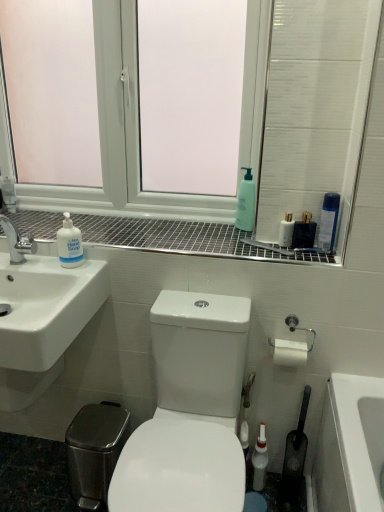
What is the approximate height of black plastic mouthwash at upper right, the third mouthwash viewed from the left?

The height of black plastic mouthwash at upper right, the third mouthwash viewed from the left, is 4.91 inches.

Where is `black plastic mouthwash at upper right, placed as the first mouthwash when sorted from right to left`? black plastic mouthwash at upper right, placed as the first mouthwash when sorted from right to left is located at coordinates [x=304, y=232].

What is the approximate width of clear plastic spray bottle at upper right, which appears as the first cleaning product when viewed from the right?

clear plastic spray bottle at upper right, which appears as the first cleaning product when viewed from the right, is 2.04 inches in width.

Identify the location of white plastic window at upper center. Image resolution: width=384 pixels, height=512 pixels. click(253, 136).

What is the approximate width of white glossy sink at lower left?

white glossy sink at lower left is 17.91 inches wide.

You are a GUI agent. You are given a task and a screenshot of the screen. Output one action in this format:
    pyautogui.click(x=<x>, y=<y>)
    Task: Click on the black plastic mouthwash at upper right, marked as the third mouthwash in a bottom-to-top arrangement
    
    Given the screenshot: What is the action you would take?
    pyautogui.click(x=304, y=232)

Does silver metallic toilet paper holder at right have a greater width compared to clear plastic spray bottle at upper right, which appears as the first cleaning product when viewed from the right?

Correct, the width of silver metallic toilet paper holder at right exceeds that of clear plastic spray bottle at upper right, which appears as the first cleaning product when viewed from the right.

Choose the correct answer: Is silver metallic toilet paper holder at right inside clear plastic spray bottle at upper right, which appears as the first cleaning product when viewed from the right, or outside it?

silver metallic toilet paper holder at right is not enclosed by clear plastic spray bottle at upper right, which appears as the first cleaning product when viewed from the right.

Is silver metallic toilet paper holder at right oriented away from clear plastic spray bottle at upper right, which appears as the first cleaning product when viewed from the right?

No, silver metallic toilet paper holder at right is not facing away from clear plastic spray bottle at upper right, which appears as the first cleaning product when viewed from the right.

What's the angular difference between silver metallic toilet paper holder at right and clear plastic spray bottle at upper right, the second cleaning product positioned from the left,'s facing directions?

They differ by 0.254 degrees in their facing directions.

Based on the photo, can you confirm if black plastic mouthwash at upper right, the third mouthwash viewed from the left, is smaller than silver metallic toilet paper holder at right?

Yes.

Is black plastic mouthwash at upper right, the third mouthwash viewed from the left, at the right side of silver metallic toilet paper holder at right?

Yes, black plastic mouthwash at upper right, the third mouthwash viewed from the left, is to the right of silver metallic toilet paper holder at right.

Which of these two, black plastic mouthwash at upper right, the third mouthwash viewed from the left, or silver metallic toilet paper holder at right, is wider?

Wider between the two is silver metallic toilet paper holder at right.

Do you think black plastic mouthwash at upper right, the third mouthwash viewed from the left, is within silver metallic toilet paper holder at right, or outside of it?

black plastic mouthwash at upper right, the third mouthwash viewed from the left, is outside silver metallic toilet paper holder at right.

From a real-world perspective, does silver metallic toilet paper holder at right stand above white glossy sink at lower left?

No, from a real-world perspective, silver metallic toilet paper holder at right is not over white glossy sink at lower left

Between silver metallic toilet paper holder at right and white glossy sink at lower left, which one has less height?

silver metallic toilet paper holder at right.

Between silver metallic toilet paper holder at right and white glossy sink at lower left, which one has larger width?

Wider between the two is white glossy sink at lower left.

From a real-world perspective, is black plastic mouthwash at upper right, marked as the third mouthwash in a bottom-to-top arrangement, physically located above or below green matte bottle at upper center?

black plastic mouthwash at upper right, marked as the third mouthwash in a bottom-to-top arrangement, is below green matte bottle at upper center.

Does point (295, 238) appear closer or farther from the camera than point (243, 185)?

Clearly, point (295, 238) is closer to the camera than point (243, 185).

Does point (42, 198) come farther from viewer compared to point (166, 465)?

Yes.

Would you say white plastic window at upper center is outside white glossy toilet at center?

Yes, white plastic window at upper center is outside of white glossy toilet at center.

Can you confirm if white plastic window at upper center is bigger than white glossy toilet at center?

No.

From the image's perspective, relative to white glossy bottle at lower center, arranged as the first mouthwash when ordered from the bottom, is white glossy mouthwash at upper right, positioned as the 2th mouthwash in bottom-to-top order, above or below?

Clearly, from the image's perspective, white glossy mouthwash at upper right, positioned as the 2th mouthwash in bottom-to-top order, is above white glossy bottle at lower center, arranged as the first mouthwash when ordered from the bottom.

Does point (281, 244) come behind point (264, 465)?

No.

Choose the correct answer: Is white glossy mouthwash at upper right, the 2th mouthwash in the left-to-right sequence, inside white glossy bottle at lower center, arranged as the 3th mouthwash when viewed from the top, or outside it?

white glossy mouthwash at upper right, the 2th mouthwash in the left-to-right sequence, exists outside the volume of white glossy bottle at lower center, arranged as the 3th mouthwash when viewed from the top.

Is white glossy sink at lower left positioned with its back to white matte hand soap at left, which is the 1th cleaning product from left to right?

No, white glossy sink at lower left's orientation is not away from white matte hand soap at left, which is the 1th cleaning product from left to right.

Which is nearer, (3, 223) or (73, 240)?

Point (3, 223) is farther from the camera than point (73, 240).

Is white glossy sink at lower left far from white matte hand soap at left, the second cleaning product positioned from the right?

No.

How many degrees apart are the facing directions of white glossy sink at lower left and white matte hand soap at left, the second cleaning product positioned from the right?

The angular difference between white glossy sink at lower left and white matte hand soap at left, the second cleaning product positioned from the right, is 0.835 degrees.

Image resolution: width=384 pixels, height=512 pixels. I want to click on towel bar that is on the left side of clear plastic spray bottle at upper right, the second cleaning product positioned from the left, so pos(291,346).

In order to click on towel bar below the black plastic mouthwash at upper right, placed as the first mouthwash when sorted from right to left (from the image's perspective) in this screenshot , I will do `click(291, 346)`.

Which object lies nearer to the anchor point white glossy toilet at center, white glossy sink at upper left or white matte hand soap at left, which is the 1th cleaning product from left to right?

white glossy sink at upper left is closer to white glossy toilet at center.

Estimate the real-world distances between objects in this image. Which object is further from white glossy mouthwash at upper right, which is counted as the 2th mouthwash, starting from the top, white glossy sink at lower left or clear plastic spray bottle at upper right, the second cleaning product positioned from the left?

white glossy sink at lower left is further to white glossy mouthwash at upper right, which is counted as the 2th mouthwash, starting from the top.

Estimate the real-world distances between objects in this image. Which object is further from white glossy sink at upper left, white matte hand soap at left, which is the 1th cleaning product from left to right, or clear plastic spray bottle at upper right, the second cleaning product positioned from the left?

clear plastic spray bottle at upper right, the second cleaning product positioned from the left, lies further to white glossy sink at upper left than the other object.

Based on their spatial positions, is white glossy bottle at lower center, arranged as the first mouthwash when ordered from the bottom, or white glossy sink at upper left closer to silver metallic toilet paper holder at right?

white glossy bottle at lower center, arranged as the first mouthwash when ordered from the bottom, lies closer to silver metallic toilet paper holder at right than the other object.

Which object lies nearer to the anchor point black plastic mouthwash at upper right, marked as the third mouthwash in a bottom-to-top arrangement, clear plastic spray bottle at upper right, the second cleaning product positioned from the left, or silver metallic toilet paper holder at right?

Among the two, clear plastic spray bottle at upper right, the second cleaning product positioned from the left, is located nearer to black plastic mouthwash at upper right, marked as the third mouthwash in a bottom-to-top arrangement.

Considering their positions, is white glossy sink at lower left positioned closer to white glossy sink at upper left than white matte hand soap at left, which is the 1th cleaning product from left to right?

Among the two, white matte hand soap at left, which is the 1th cleaning product from left to right, is located nearer to white glossy sink at upper left.

Estimate the real-world distances between objects in this image. Which object is further from clear plastic spray bottle at upper right, which appears as the first cleaning product when viewed from the right, white glossy toilet at center or white glossy sink at upper left?

Among the two, white glossy toilet at center is located further to clear plastic spray bottle at upper right, which appears as the first cleaning product when viewed from the right.

Estimate the real-world distances between objects in this image. Which object is closer to black plastic mouthwash at upper right, placed as the first mouthwash when sorted from right to left, white matte hand soap at left, the second cleaning product positioned from the right, or white glossy toilet at center?

white glossy toilet at center is closer to black plastic mouthwash at upper right, placed as the first mouthwash when sorted from right to left.

You are a GUI agent. You are given a task and a screenshot of the screen. Output one action in this format:
    pyautogui.click(x=<x>, y=<y>)
    Task: Click on the window located between white glossy sink at lower left and black plastic mouthwash at upper right, marked as the third mouthwash in a bottom-to-top arrangement, in the left-right direction
    
    Given the screenshot: What is the action you would take?
    pyautogui.click(x=253, y=136)

Locate an element on the screen. This screenshot has height=512, width=384. sink between white glossy sink at upper left and white glossy bottle at lower center, arranged as the first mouthwash when ordered from the bottom, in the up-down direction is located at coordinates (42, 321).

Identify the location of cleaning product between black plastic mouthwash at upper right, the third mouthwash viewed from the left, and white glossy bottle at lower center, which appears as the 1th mouthwash when viewed from the left, in the up-down direction. The image size is (384, 512). (69, 244).

Where is `cleaning product that lies between white glossy mouthwash at upper right, positioned as the 2th mouthwash in bottom-to-top order, and white glossy bottle at lower center, arranged as the 3th mouthwash when viewed from the top, from top to bottom`? cleaning product that lies between white glossy mouthwash at upper right, positioned as the 2th mouthwash in bottom-to-top order, and white glossy bottle at lower center, arranged as the 3th mouthwash when viewed from the top, from top to bottom is located at coordinates (69, 244).